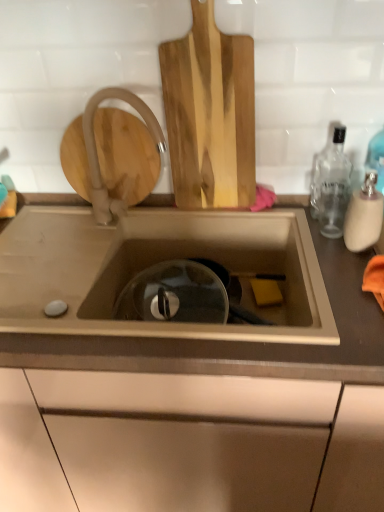
Question: Relative to translucent glass bottle at right, which ranks as the first bottle in front-to-back order, is matte white faucet at upper left in front or behind?

Choices:
 (A) behind
 (B) front

Answer: (A)

Question: Is point (152, 114) closer or farther from the camera than point (377, 226)?

Choices:
 (A) closer
 (B) farther

Answer: (B)

Question: Considering the real-world distances, which object is closest to the matte white faucet at upper left?

Choices:
 (A) natural wood cutting board at upper center
 (B) clear glass bottle at right, the 1th bottle in the back-to-front sequence
 (C) translucent glass bottle at right, which appears as the second bottle when viewed from the back
 (D) matte brown countertop at center

Answer: (A)

Question: Estimate the real-world distances between objects in this image. Which object is farther from the matte brown countertop at center?

Choices:
 (A) matte white faucet at upper left
 (B) natural wood cutting board at upper center
 (C) clear glass bottle at right, the 1th bottle in the back-to-front sequence
 (D) translucent glass bottle at right, which ranks as the first bottle in front-to-back order

Answer: (D)